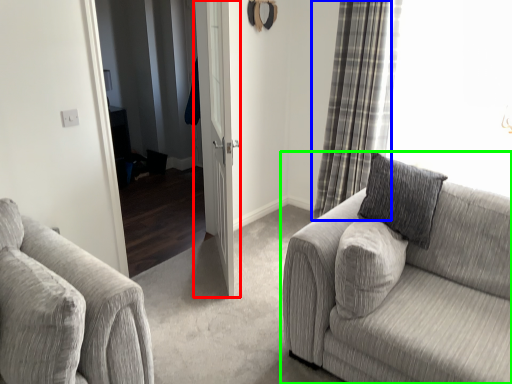
Question: Which object is positioned closest to door (highlighted by a red box)? Select from curtain (highlighted by a blue box) and studio couch (highlighted by a green box).

Choices:
 (A) curtain
 (B) studio couch

Answer: (A)